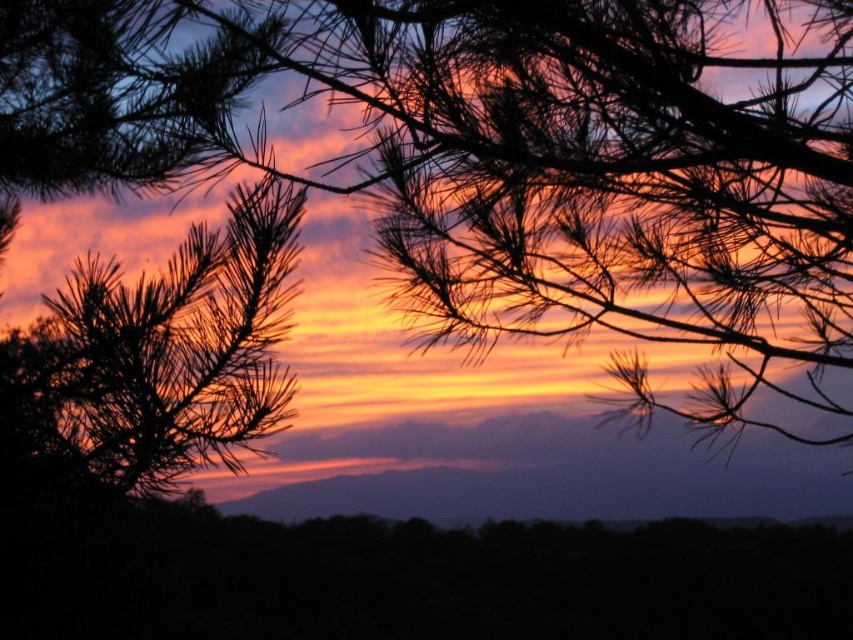
Question: Among these points, which one is farthest from the camera?

Choices:
 (A) (223, 337)
 (B) (666, 17)

Answer: (B)

Question: Does silky dark green pine branches at upper center lie in front of silky brown pine branch at left?

Choices:
 (A) yes
 (B) no

Answer: (B)

Question: Where is silky dark green pine branches at upper center located in relation to silky brown pine branch at left in the image?

Choices:
 (A) below
 (B) above

Answer: (B)

Question: Can you confirm if silky dark green pine branches at upper center is wider than silky brown pine branch at left?

Choices:
 (A) yes
 (B) no

Answer: (A)

Question: Among these points, which one is nearest to the camera?

Choices:
 (A) (448, 170)
 (B) (103, 422)

Answer: (A)